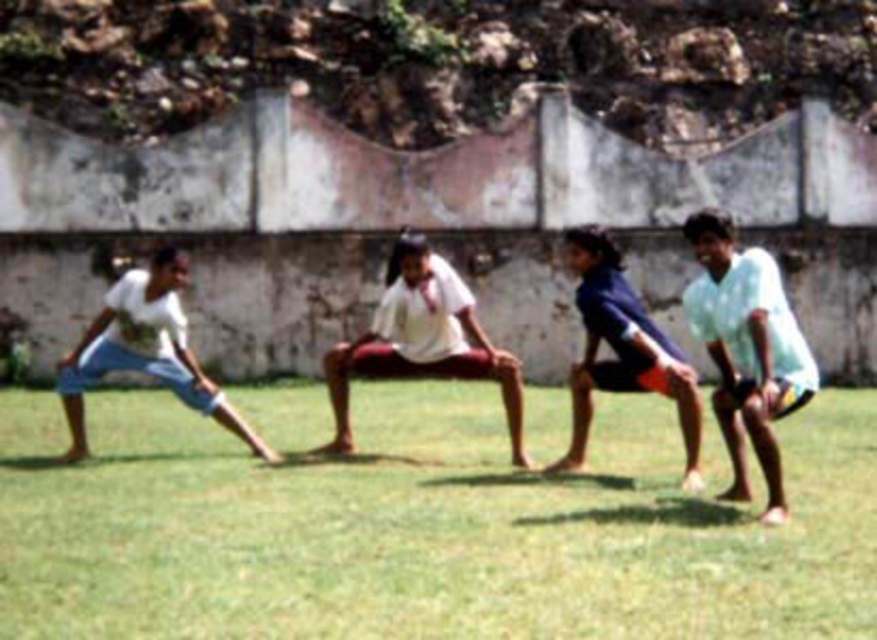
Question: Which object appears farthest from the camera in this image?

Choices:
 (A) white matte shorts at right
 (B) white cotton shirt at center
 (C) white cotton shorts at left

Answer: (B)

Question: Which is nearer to the white cotton shirt at center?

Choices:
 (A) white cotton shorts at left
 (B) green grass at center
 (C) dark blue fabric shorts at center
 (D) white matte shorts at right

Answer: (C)

Question: Can you confirm if green grass at center is positioned below dark blue fabric shorts at center?

Choices:
 (A) no
 (B) yes

Answer: (B)

Question: Can you confirm if white cotton shorts at left is positioned above dark blue fabric shorts at center?

Choices:
 (A) no
 (B) yes

Answer: (A)

Question: Which point is farther to the camera?

Choices:
 (A) (761, 339)
 (B) (407, 362)
 (C) (642, 336)

Answer: (B)

Question: Does white matte shorts at right have a larger size compared to white cotton shorts at left?

Choices:
 (A) yes
 (B) no

Answer: (B)